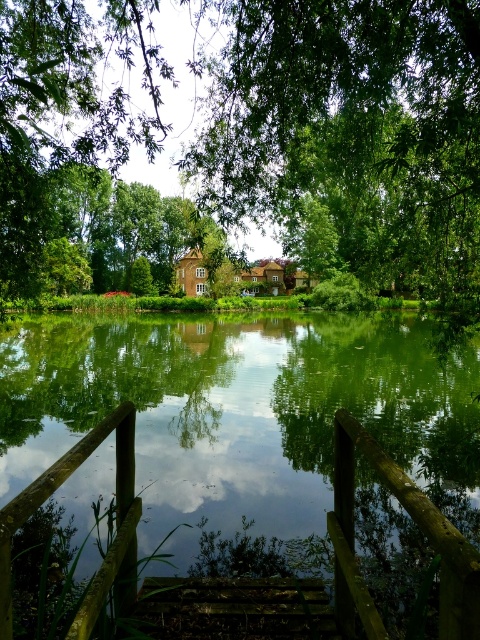
You are standing on the wooden bridge and want to take a photo of the green leafy tree at center. Which direction should you face to capture it in your shot?

The green leafy tree at center is located at point (249, 140), so you should face towards the center of the scene to capture it in your photo.

You are standing on the wooden bridge and want to place a picnic basket between the green leafy tree at center and the brown wooden rail at lower center. Which object should you place it closer to if you want the basket to be closer to the wider object?

The green leafy tree at center might be wider than brown wooden rail at lower center, so you should place the picnic basket closer to the green leafy tree at center.

You are a painter setting up your easel to capture the scene of the green leafy tree at center and the wooden rail at lower left. You want to emphasize the size difference between them. Which object should you place closer to the foreground to make the tree appear larger than the rail?

The green leafy tree at center is wider than the wooden rail at lower left. To emphasize the size difference, place the green leafy tree at center closer to the foreground so it appears larger compared to the wooden rail at lower left.